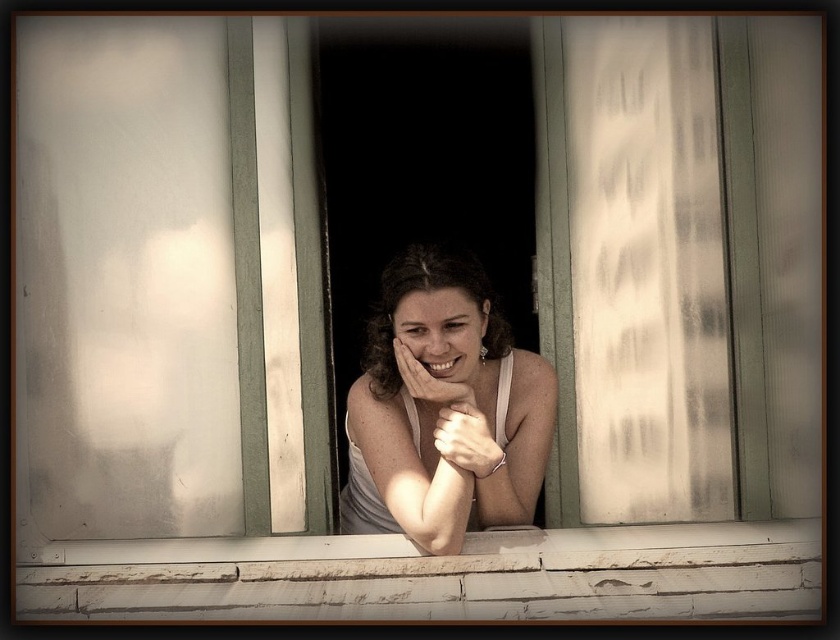
Question: Does white painted wood at center have a lesser width compared to matte skin hand at center?

Choices:
 (A) yes
 (B) no

Answer: (B)

Question: Can you confirm if matte white tank top at center is positioned above matte skin hand at center?

Choices:
 (A) no
 (B) yes

Answer: (A)

Question: Which object appears farthest from the camera in this image?

Choices:
 (A) matte silver bracelet at center
 (B) white painted wood at center
 (C) matte white tank top at center
 (D) matte skin hand at center

Answer: (D)

Question: Is matte white tank top at center above matte silver bracelet at center?

Choices:
 (A) no
 (B) yes

Answer: (B)

Question: Which point is farther from the camera taking this photo?

Choices:
 (A) (403, 356)
 (B) (284, 586)
 (C) (361, 420)
 (D) (449, 435)

Answer: (C)

Question: Which of these objects is positioned farthest from the matte skin hand at center?

Choices:
 (A) white painted wood at center
 (B) matte white tank top at center
 (C) matte silver bracelet at center

Answer: (A)